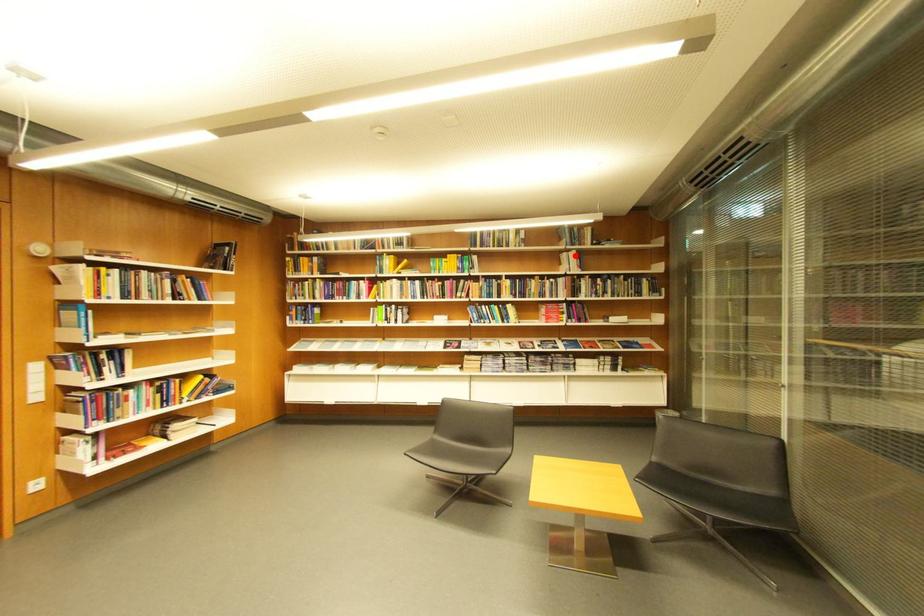
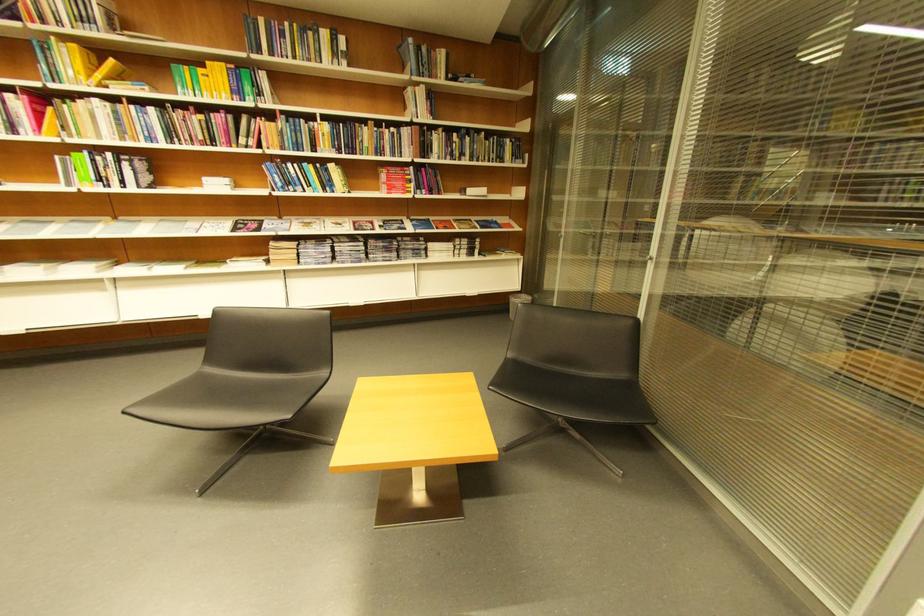
Find the pixel in the second image that matches the highlighted location in the first image.

(419, 91)